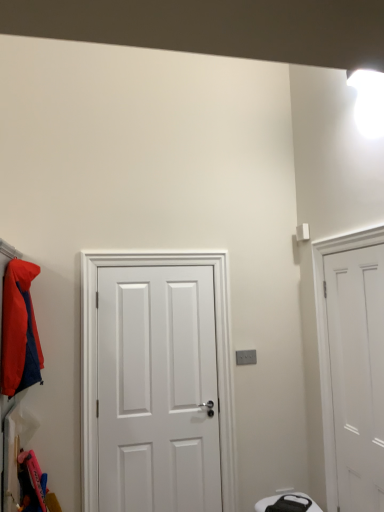
Question: From a real-world perspective, is matte orange jacket at left positioned under white matte door at right, marked as the 1th door in a right-to-left arrangement, based on gravity?

Choices:
 (A) yes
 (B) no

Answer: (B)

Question: Is matte orange jacket at left thinner than white matte door at right, placed as the 2th door when sorted from left to right?

Choices:
 (A) no
 (B) yes

Answer: (A)

Question: From the image's perspective, is matte orange jacket at left located beneath white matte door at right, marked as the 1th door in a right-to-left arrangement?

Choices:
 (A) no
 (B) yes

Answer: (A)

Question: Is white matte door at right, marked as the 1th door in a right-to-left arrangement, surrounded by matte orange jacket at left?

Choices:
 (A) yes
 (B) no

Answer: (B)

Question: Is matte orange jacket at left to the left of white matte door at right, marked as the 1th door in a right-to-left arrangement, from the viewer's perspective?

Choices:
 (A) no
 (B) yes

Answer: (B)

Question: Does matte orange jacket at left have a lesser height compared to white matte door at right, placed as the 2th door when sorted from left to right?

Choices:
 (A) no
 (B) yes

Answer: (B)

Question: Considering the relative sizes of white matte door at right, marked as the 1th door in a right-to-left arrangement, and white matte door at center, acting as the 2th door starting from the right, in the image provided, is white matte door at right, marked as the 1th door in a right-to-left arrangement, shorter than white matte door at center, acting as the 2th door starting from the right,?

Choices:
 (A) no
 (B) yes

Answer: (B)

Question: From a real-world perspective, is white matte door at right, marked as the 1th door in a right-to-left arrangement, physically below white matte door at center, acting as the 2th door starting from the right?

Choices:
 (A) yes
 (B) no

Answer: (B)

Question: Is white matte door at right, marked as the 1th door in a right-to-left arrangement, looking in the opposite direction of white matte door at center, which ranks as the 1th door in left-to-right order?

Choices:
 (A) no
 (B) yes

Answer: (A)

Question: Is white matte door at right, placed as the 2th door when sorted from left to right, in front of white matte door at center, acting as the 2th door starting from the right?

Choices:
 (A) yes
 (B) no

Answer: (A)

Question: Is white matte door at center, which ranks as the 1th door in left-to-right order, completely or partially inside white matte door at right, marked as the 1th door in a right-to-left arrangement?

Choices:
 (A) no
 (B) yes

Answer: (A)

Question: Is white matte door at right, marked as the 1th door in a right-to-left arrangement, positioned far away from white matte door at center, acting as the 2th door starting from the right?

Choices:
 (A) yes
 (B) no

Answer: (A)

Question: Is white matte door at center, which ranks as the 1th door in left-to-right order, looking in the opposite direction of white matte door at right, marked as the 1th door in a right-to-left arrangement?

Choices:
 (A) no
 (B) yes

Answer: (A)